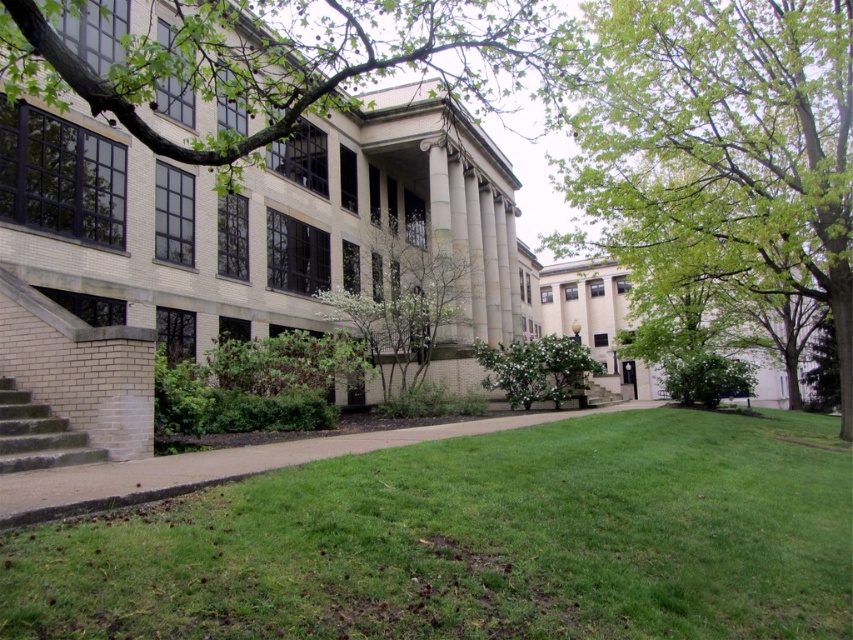
You are a student standing at the bottom of the brick stairs at lower left, looking up towards the green leafy branch at upper left. Which object appears taller from your perspective?

The green leafy branch at upper left appears taller than the brick stairs at lower left because it has a greater height compared to the brick stairs at lower left.

You are a gardener who needs to mow the green grass at lower center. However, there is a green leafy bush at center in the way. Can you mow the grass without moving the bush?

The green grass at lower center is positioned under the green leafy bush at center, so you can still mow the grass without moving the bush because the grass is underneath it and accessible.

You are standing on the grassy area in front of the academic building and want to walk to the front entrance. You notice two points marked on the ground at coordinates point (276, 134) and point (351, 294). Which point is closer to you as you stand on the grassy area?

Point (276, 134) is closer to the viewer than point (351, 294), so the point at (276, 134) is closer to you as you stand on the grassy area.